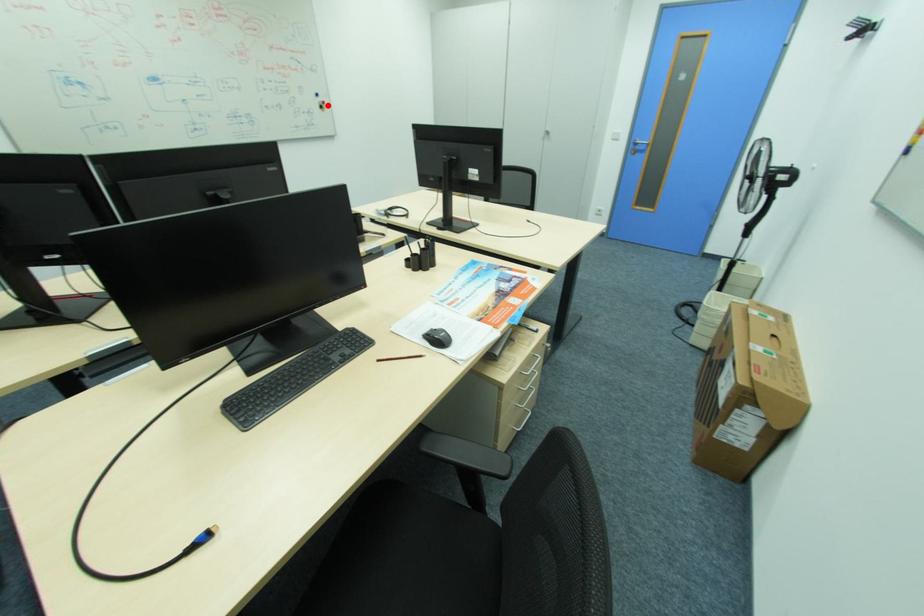
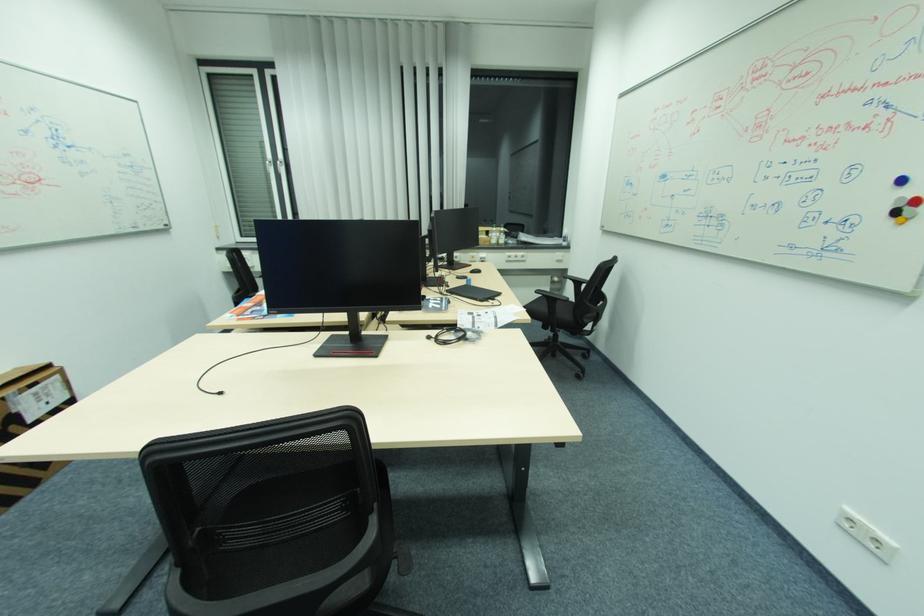
Where in the second image is the point corresponding to the highlighted location from the first image?

(907, 206)